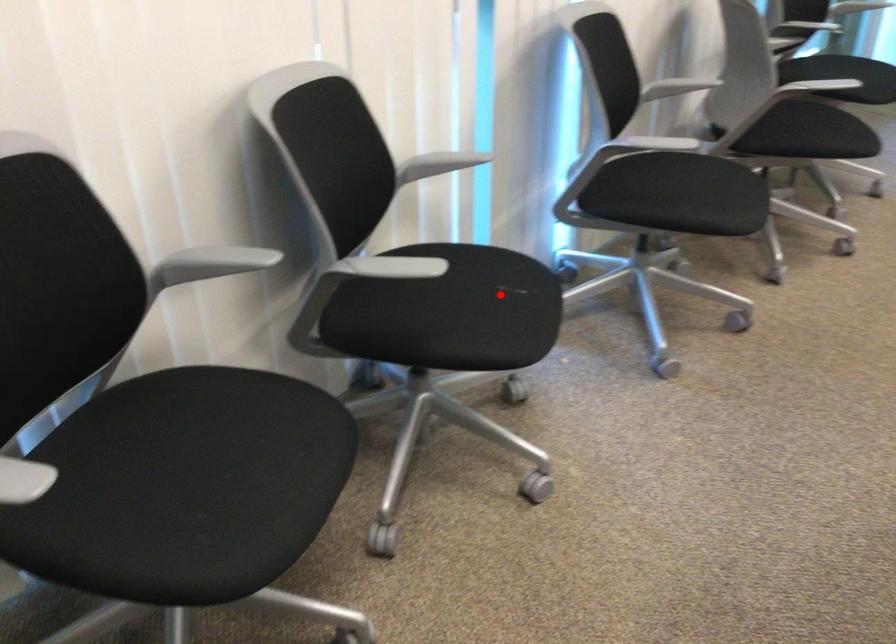
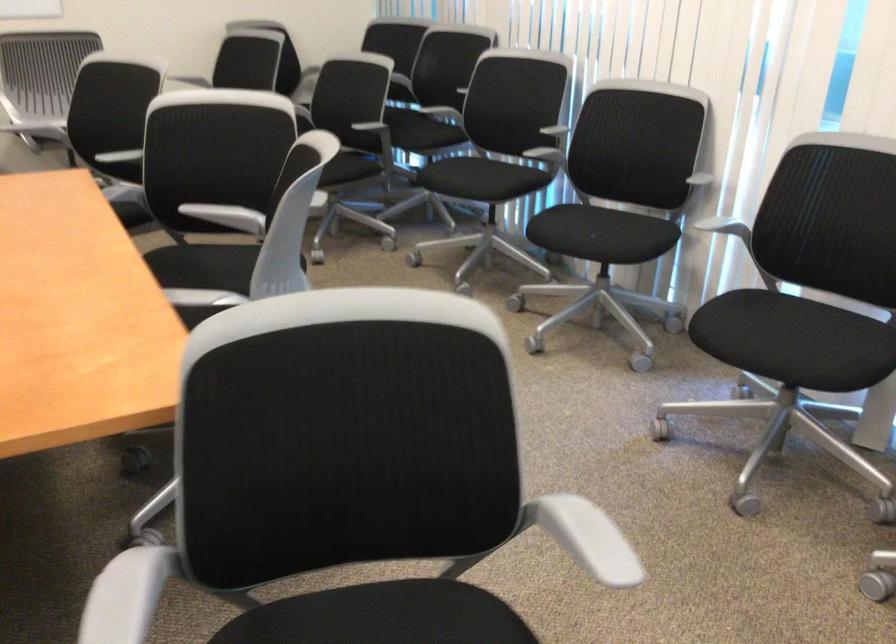
Find the pixel in the second image that matches the highlighted location in the first image.

(582, 232)